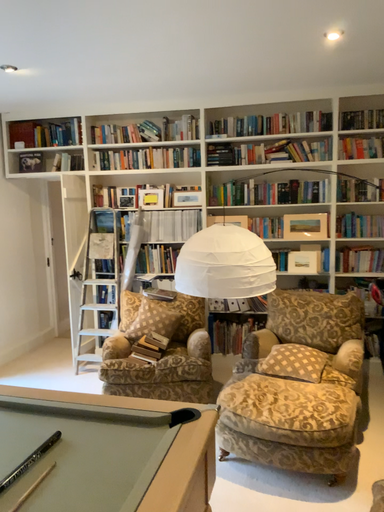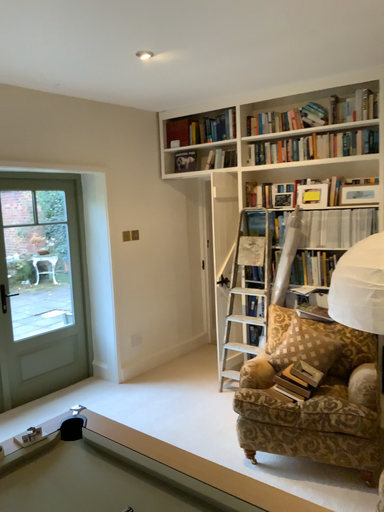
Question: Which way did the camera rotate in the video?

Choices:
 (A) rotated right
 (B) rotated left

Answer: (B)